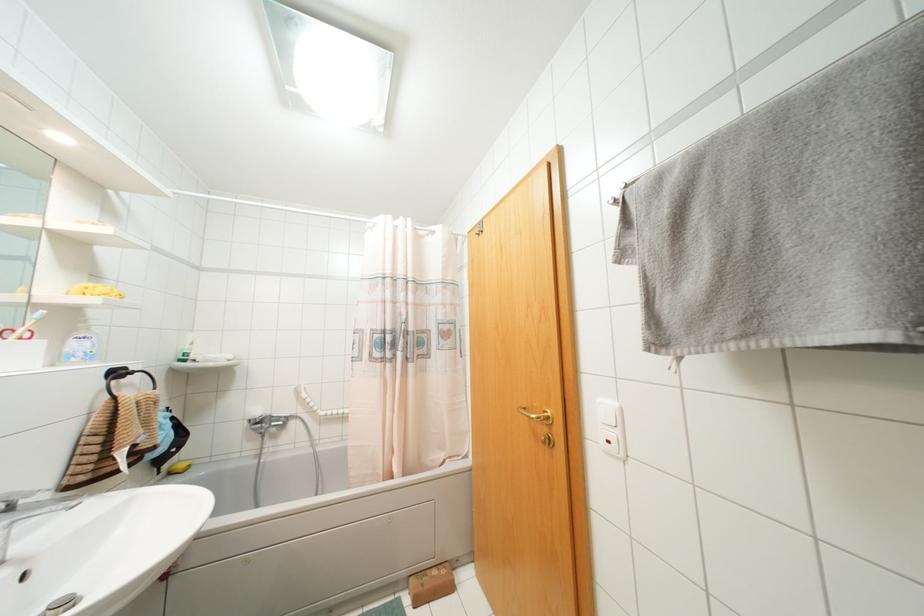
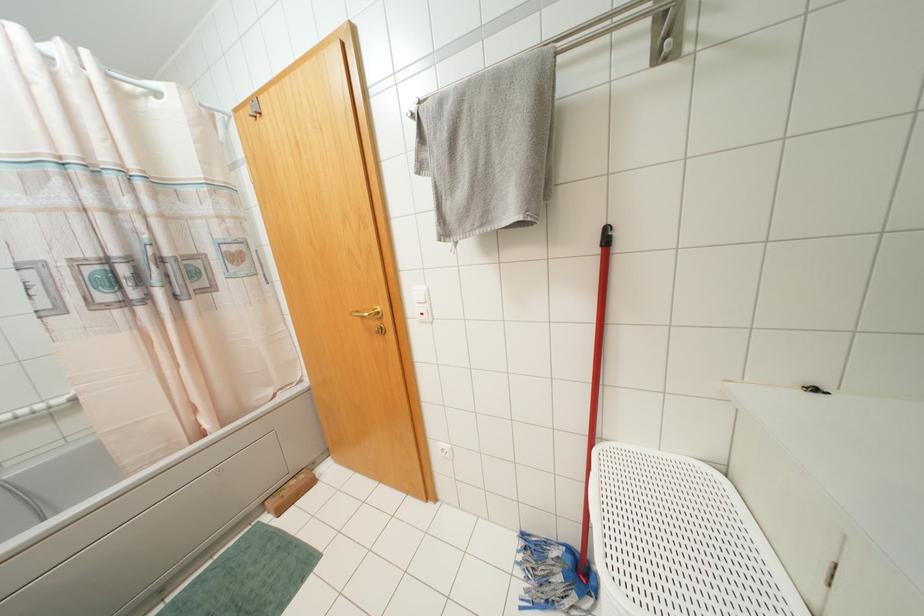
Based on the continuous images, in which direction is the camera rotating?

The camera's rotation is toward right-down.